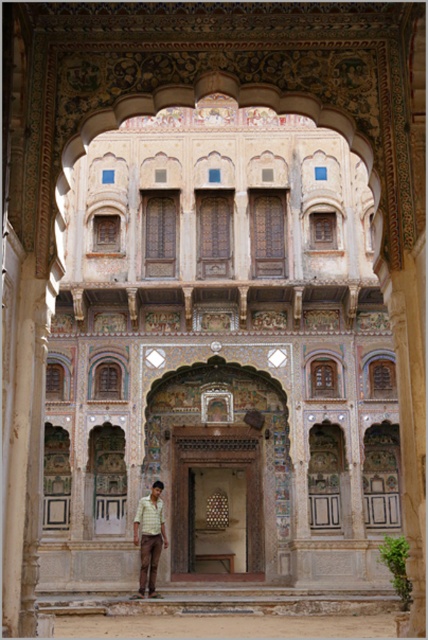
Question: Can you confirm if checkered shirt at center is smaller than yellow checkered shirt at lower center?

Choices:
 (A) no
 (B) yes

Answer: (B)

Question: Which point appears closest to the camera in this image?

Choices:
 (A) (154, 534)
 (B) (162, 506)

Answer: (A)

Question: Is checkered shirt at center positioned at the back of yellow checkered shirt at lower center?

Choices:
 (A) no
 (B) yes

Answer: (B)

Question: Does checkered shirt at center appear over yellow checkered shirt at lower center?

Choices:
 (A) yes
 (B) no

Answer: (A)